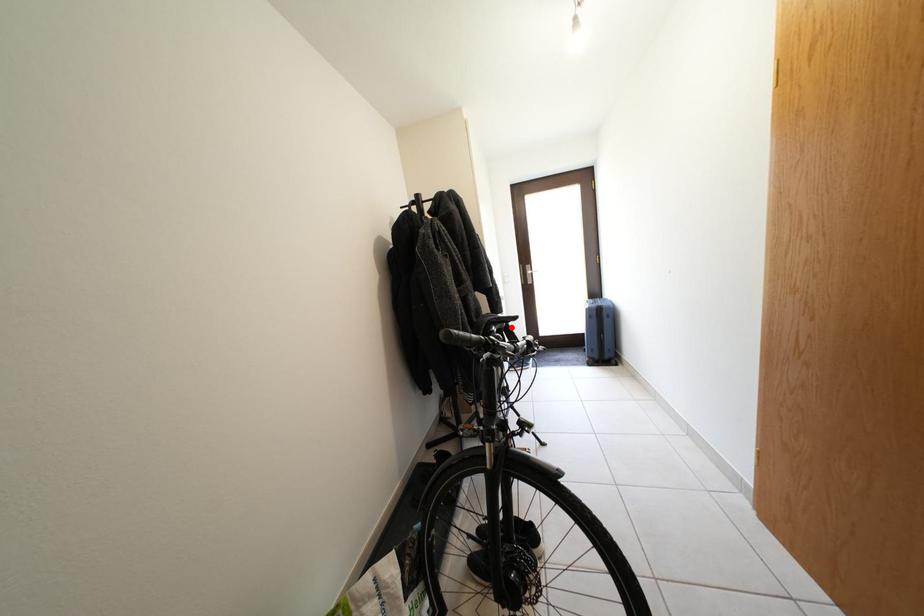
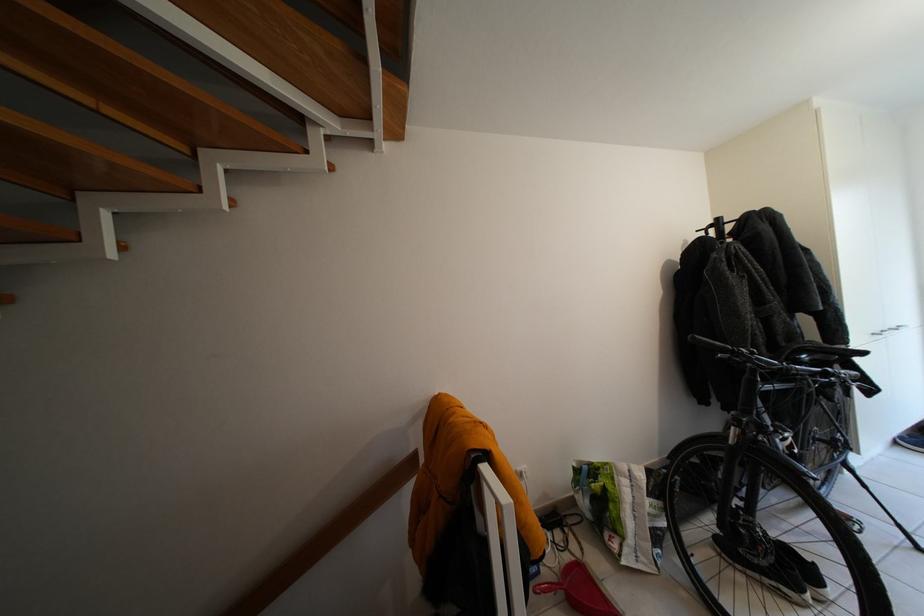
Locate, in the second image, the point that corresponds to the highlighted location in the first image.

(841, 360)